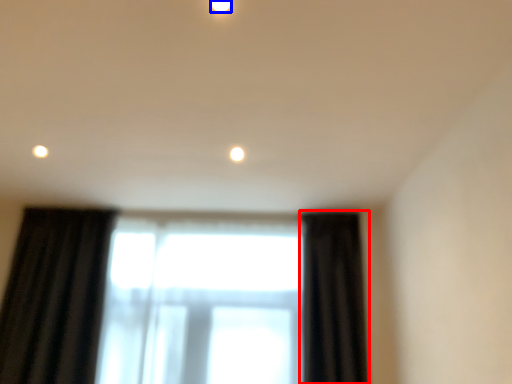
Question: Which object is further to the camera taking this photo, curtain (highlighted by a red box) or lighting (highlighted by a blue box)?

Choices:
 (A) curtain
 (B) lighting

Answer: (A)